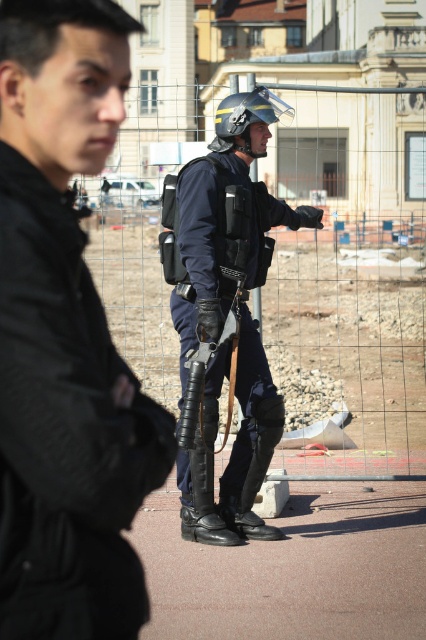
Does point (37, 189) lie behind point (379, 364)?

No, (37, 189) is in front of (379, 364).

Can you confirm if black matte jacket at left is positioned to the right of metal mesh fence at center?

No, black matte jacket at left is not to the right of metal mesh fence at center.

Is point (14, 484) farther from viewer compared to point (399, 273)?

No, (14, 484) is in front of (399, 273).

Identify the location of black matte jacket at left. Image resolution: width=426 pixels, height=640 pixels. (65, 339).

Which is behind, point (291, 237) or point (213, 388)?

Point (291, 237)

Which is behind, point (345, 368) or point (181, 170)?

Point (345, 368)

Find the location of a particular element. metal mesh fence at center is located at coordinates (348, 280).

Measure the distance between metal mesh fence at center and camera.

The distance of metal mesh fence at center from camera is 22.33 feet.

Who is taller, metal mesh fence at center or shiny black helmet at center?

Standing taller between the two is metal mesh fence at center.

Who is more forward, (x=411, y=474) or (x=218, y=140)?

Point (x=218, y=140) is more forward.

In order to click on metal mesh fence at center in this screenshot , I will do `click(348, 280)`.